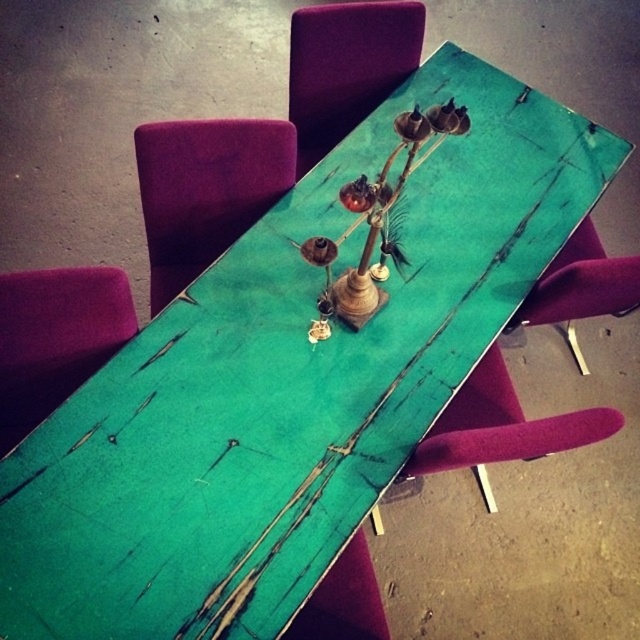
You are standing at the origin point in the dining area. Where is the velvet magenta chair at lower right located in terms of coordinates?

The velvet magenta chair at lower right is located at coordinates point (497, 429).

You are a guest at a dinner party and need to choose between the purple fabric chair at left and the teal wood chair at center. Which chair would you choose if you prefer a taller seat?

The purple fabric chair at left is much taller than the teal wood chair at center, so you should choose the purple fabric chair at left for a taller seat.